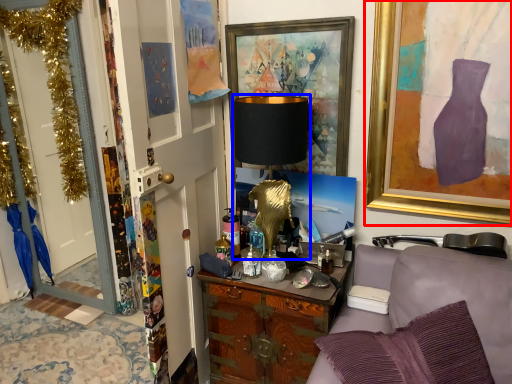
Question: Which object appears farthest to the camera in this image, picture frame (highlighted by a red box) or table lamp (highlighted by a blue box)?

Choices:
 (A) picture frame
 (B) table lamp

Answer: (B)